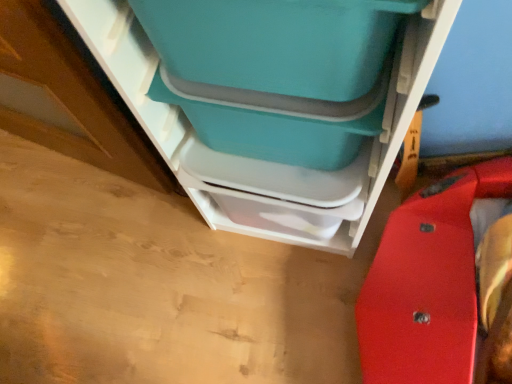
Where is `vacant area that is in front of teal plastic storage bin at upper center`? The height and width of the screenshot is (384, 512). vacant area that is in front of teal plastic storage bin at upper center is located at coordinates (289, 314).